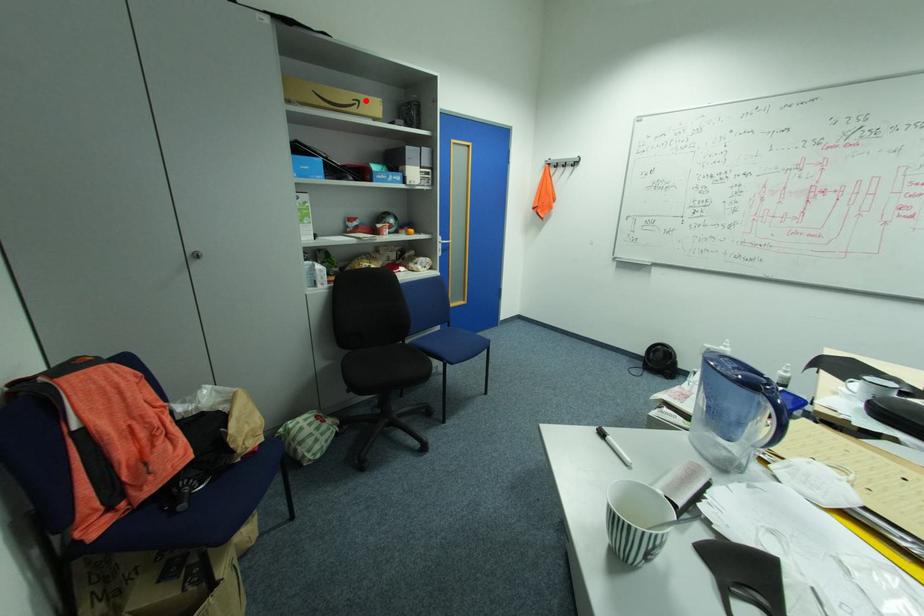
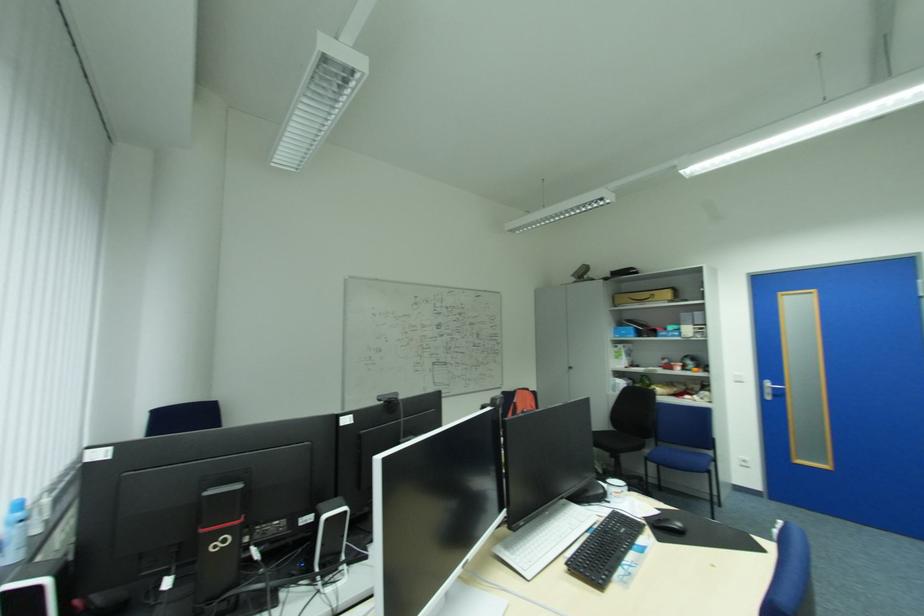
In the second image, find the point that corresponds to the highlighted location in the first image.

(659, 294)